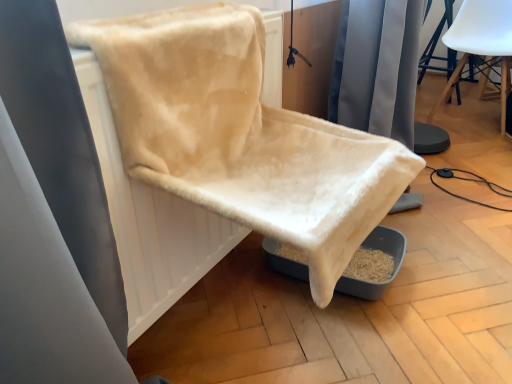
Question: Is white matte chair at upper right, the 2th chair ordered from the bottom, not within beige fabric radiator at center?

Choices:
 (A) yes
 (B) no

Answer: (A)

Question: Does white matte chair at upper right, the 2th chair ordered from the bottom, come in front of beige fabric radiator at center?

Choices:
 (A) no
 (B) yes

Answer: (A)

Question: Is white matte chair at upper right, which is counted as the second chair, starting from the front, with beige fabric radiator at center?

Choices:
 (A) no
 (B) yes

Answer: (A)

Question: Considering the relative sizes of white matte chair at upper right, the 2th chair ordered from the bottom, and beige fabric radiator at center in the image provided, is white matte chair at upper right, the 2th chair ordered from the bottom, thinner than beige fabric radiator at center?

Choices:
 (A) no
 (B) yes

Answer: (A)

Question: Is white matte chair at upper right, arranged as the 1th chair when viewed from the top, facing away from beige fabric radiator at center?

Choices:
 (A) yes
 (B) no

Answer: (B)

Question: From the image's perspective, is white matte chair at upper right, arranged as the 1th chair when viewed from the top, positioned above or below beige fabric radiator at center?

Choices:
 (A) below
 (B) above

Answer: (B)

Question: Considering the positions of white matte chair at upper right, which is the 1th chair in right-to-left order, and beige fabric radiator at center in the image, is white matte chair at upper right, which is the 1th chair in right-to-left order, taller or shorter than beige fabric radiator at center?

Choices:
 (A) tall
 (B) short

Answer: (A)

Question: Is point pyautogui.click(x=503, y=130) closer or farther from the camera than point pyautogui.click(x=108, y=114)?

Choices:
 (A) farther
 (B) closer

Answer: (A)

Question: In the image, is white matte chair at upper right, arranged as the 1th chair when viewed from the top, positioned in front of or behind beige fabric radiator at center?

Choices:
 (A) front
 (B) behind

Answer: (B)

Question: Does point (314, 134) appear closer or farther from the camera than point (478, 41)?

Choices:
 (A) closer
 (B) farther

Answer: (A)

Question: Considering the relative positions of beige plush chair at center, which is counted as the second chair, starting from the right, and white matte chair at upper right, which ranks as the 2th chair in left-to-right order, in the image provided, is beige plush chair at center, which is counted as the second chair, starting from the right, to the left or to the right of white matte chair at upper right, which ranks as the 2th chair in left-to-right order,?

Choices:
 (A) right
 (B) left

Answer: (B)

Question: Is beige plush chair at center, the 1th chair in the left-to-right sequence, taller or shorter than white matte chair at upper right, which ranks as the 2th chair in left-to-right order?

Choices:
 (A) tall
 (B) short

Answer: (B)

Question: Is beige plush chair at center, the 1th chair in the left-to-right sequence, inside or outside of white matte chair at upper right, which ranks as the 2th chair in left-to-right order?

Choices:
 (A) outside
 (B) inside

Answer: (A)

Question: From a real-world perspective, is beige fabric radiator at center physically located above or below white matte chair at upper right, which is the 1th chair in right-to-left order?

Choices:
 (A) above
 (B) below

Answer: (A)

Question: In terms of width, does beige fabric radiator at center look wider or thinner when compared to white matte chair at upper right, arranged as the 1th chair when viewed from the top?

Choices:
 (A) wide
 (B) thin

Answer: (B)